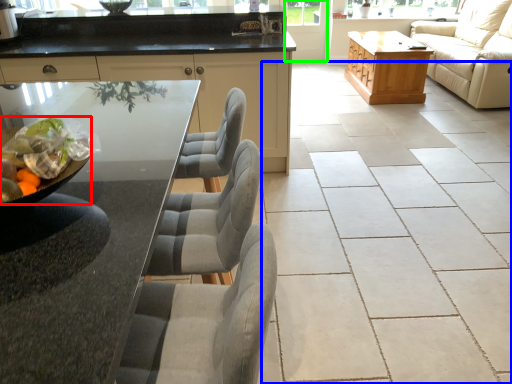
Question: Which is nearer to the food (highlighted by a red box)? ceramic tile (highlighted by a blue box) or screen door (highlighted by a green box).

Choices:
 (A) ceramic tile
 (B) screen door

Answer: (A)